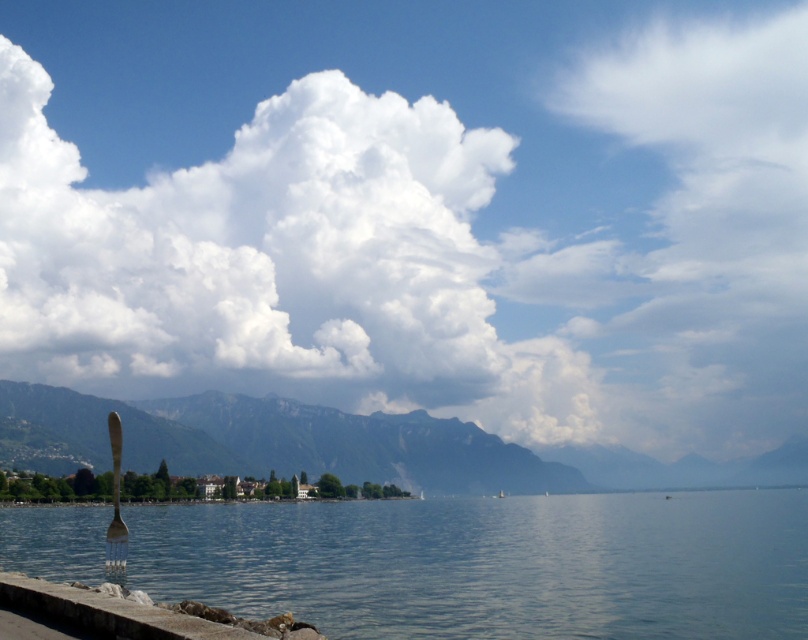
Can you confirm if white fluffy cloud at upper center is thinner than clear glass water at lower left?

No, white fluffy cloud at upper center is not thinner than clear glass water at lower left.

Does point (208, 74) come in front of point (548, 600)?

No, (208, 74) is further to viewer.

Between point (495, 68) and point (74, 529), which one is positioned in front?

Positioned in front is point (74, 529).

Locate an element on the screen. white fluffy cloud at upper center is located at coordinates (415, 211).

Is clear glass water at lower left to the left of gray stone ledge at lower left from the viewer's perspective?

In fact, clear glass water at lower left is to the right of gray stone ledge at lower left.

Does clear glass water at lower left have a larger size compared to gray stone ledge at lower left?

Yes, clear glass water at lower left is bigger than gray stone ledge at lower left.

Is point (710, 499) positioned behind point (13, 604)?

Yes, point (710, 499) is farther from viewer.

Image resolution: width=808 pixels, height=640 pixels. In order to click on clear glass water at lower left in this screenshot , I will do `click(491, 563)`.

Is white fluffy cloud at upper center to the left of matte gray mountain at center from the viewer's perspective?

Correct, you'll find white fluffy cloud at upper center to the left of matte gray mountain at center.

Does white fluffy cloud at upper center lie behind matte gray mountain at center?

That is True.

Does point (452, 195) come farther from viewer compared to point (74, 444)?

Yes.

At what (x,y) coordinates should I click in order to perform the action: click on white fluffy cloud at upper center. Please return your answer as a coordinate pair (x, y). The height and width of the screenshot is (640, 808). Looking at the image, I should click on (415, 211).